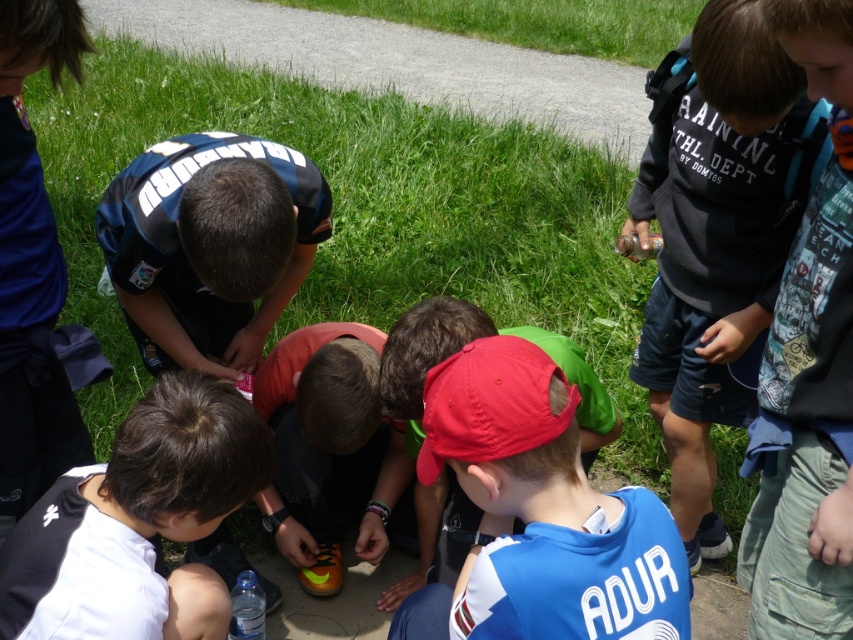
Question: Which object is farther from the camera taking this photo?

Choices:
 (A) orange matte soccer shoe at center
 (B) green grass at center
 (C) black matte shirt at lower left
 (D) blue jersey at center

Answer: (B)

Question: Which point is farther to the camera?

Choices:
 (A) blue jersey at center
 (B) dark gray sweatshirt at upper right
 (C) red matte cap at center

Answer: (A)

Question: Is red matte cap at center to the left of black matte shirt at lower left from the viewer's perspective?

Choices:
 (A) no
 (B) yes

Answer: (A)

Question: Is black matte shirt at lower left wider than blue jersey at center?

Choices:
 (A) no
 (B) yes

Answer: (A)

Question: Can you confirm if black matte shirt at lower left is bigger than blue jersey at center?

Choices:
 (A) yes
 (B) no

Answer: (B)

Question: Among these points, which one is farthest from the camera?

Choices:
 (A) (171, 147)
 (B) (759, 272)

Answer: (B)